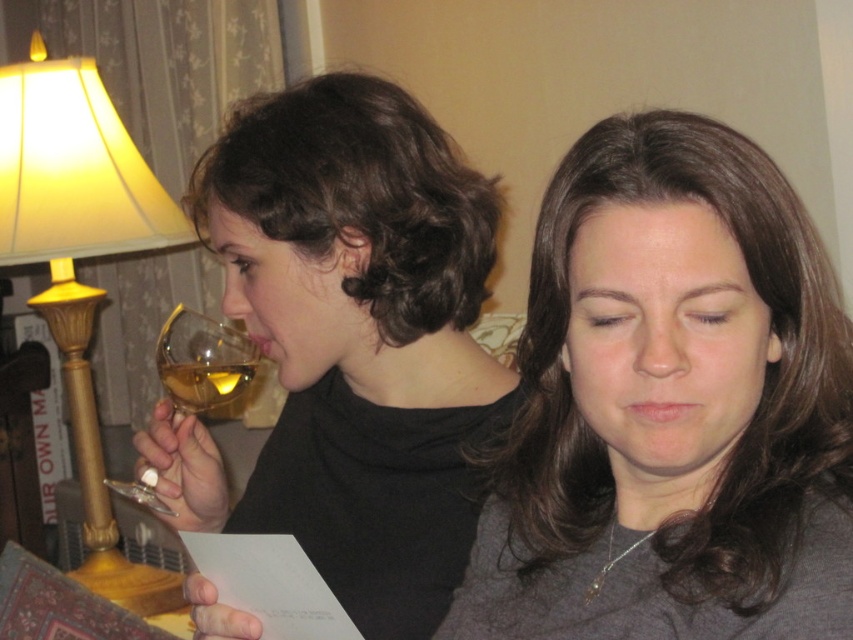
Question: Does dark brown hair at left appear under gold metallic lampshade at left?

Choices:
 (A) no
 (B) yes

Answer: (A)

Question: Is gold metallic lampshade at left further to camera compared to translucent glass wine at upper left?

Choices:
 (A) yes
 (B) no

Answer: (A)

Question: Estimate the real-world distances between objects in this image. Which object is closer to the translucent glass wine glass at left?

Choices:
 (A) gold metallic lampshade at left
 (B) translucent glass wine at upper left
 (C) matte black wine glass at left
 (D) smooth brown hair at center

Answer: (B)

Question: Which point appears closest to the camera in this image?

Choices:
 (A) (18, 106)
 (B) (170, 378)
 (C) (299, 486)

Answer: (B)

Question: Is matte black wine glass at left below gold metallic lampshade at left?

Choices:
 (A) no
 (B) yes

Answer: (B)

Question: Which object is positioned closest to the matte black wine glass at left?

Choices:
 (A) translucent glass wine glass at left
 (B) translucent glass wine at upper left
 (C) dark brown hair at left
 (D) smooth brown hair at center

Answer: (C)